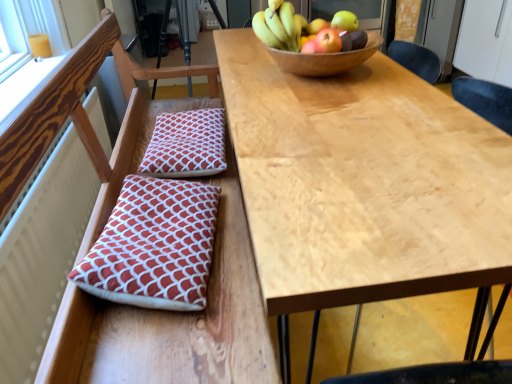
Question: From a real-world perspective, is shiny green apple at upper center, the 1th apple positioned from the back, located beneath red cotton cushion at center, the 1th pillow viewed from the top?

Choices:
 (A) no
 (B) yes

Answer: (A)

Question: Is red cotton cushion at center, which is counted as the second pillow, starting from the bottom, completely or partially inside shiny green apple at upper center, which appears as the 3th apple when viewed from the front?

Choices:
 (A) no
 (B) yes

Answer: (A)

Question: From the image's perspective, would you say shiny green apple at upper center, the 1th apple positioned from the back, is positioned over red cotton cushion at center, which is counted as the second pillow, starting from the bottom?

Choices:
 (A) no
 (B) yes

Answer: (B)

Question: Is shiny green apple at upper center, the 1th apple positioned from the back, thinner than red cotton cushion at center, the 1th pillow viewed from the top?

Choices:
 (A) no
 (B) yes

Answer: (B)

Question: Are shiny green apple at upper center, the 1th apple positioned from the back, and red cotton cushion at center, marked as the second pillow in a front-to-back arrangement, far apart?

Choices:
 (A) no
 (B) yes

Answer: (A)

Question: Is shiny green apple at upper center, which appears as the 3th apple when viewed from the front, looking in the opposite direction of red cotton cushion at center, the 1th pillow viewed from the top?

Choices:
 (A) no
 (B) yes

Answer: (A)

Question: Can you confirm if shiny yellow apple at upper right, acting as the 2th apple starting from the back, is wider than matte red apple at upper right, the 3th apple when ordered from back to front?

Choices:
 (A) no
 (B) yes

Answer: (A)

Question: From a real-world perspective, is shiny yellow apple at upper right, acting as the 2th apple starting from the back, physically below matte red apple at upper right, the 3th apple when ordered from back to front?

Choices:
 (A) no
 (B) yes

Answer: (B)

Question: Would you say shiny yellow apple at upper right, acting as the 2th apple starting from the back, contains matte red apple at upper right, the 3th apple when ordered from back to front?

Choices:
 (A) no
 (B) yes

Answer: (A)

Question: Considering the relative positions of shiny yellow apple at upper right, acting as the 2th apple starting from the back, and matte red apple at upper right, arranged as the first apple when viewed from the front, in the image provided, is shiny yellow apple at upper right, acting as the 2th apple starting from the back, in front of matte red apple at upper right, arranged as the first apple when viewed from the front,?

Choices:
 (A) no
 (B) yes

Answer: (A)

Question: Is shiny yellow apple at upper right, the 2th apple in the front-to-back sequence, thinner than matte red apple at upper right, arranged as the first apple when viewed from the front?

Choices:
 (A) yes
 (B) no

Answer: (A)

Question: Does shiny yellow apple at upper right, the 2th apple in the front-to-back sequence, have a greater height compared to matte red apple at upper right, the 3th apple when ordered from back to front?

Choices:
 (A) no
 (B) yes

Answer: (A)

Question: Does red-patterned cushion at left have a greater height compared to red cotton cushion at center, the 1th pillow viewed from the top?

Choices:
 (A) no
 (B) yes

Answer: (B)